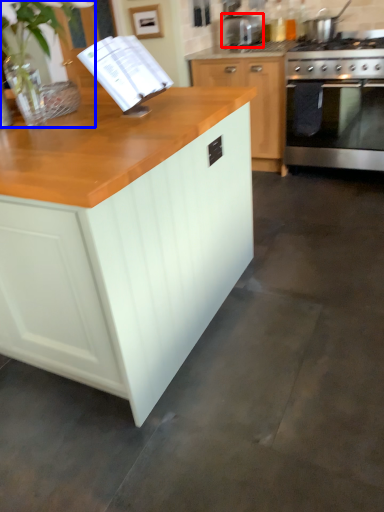
Question: Which point is closer to the camera, appliance (highlighted by a red box) or plant (highlighted by a blue box)?

Choices:
 (A) appliance
 (B) plant

Answer: (B)